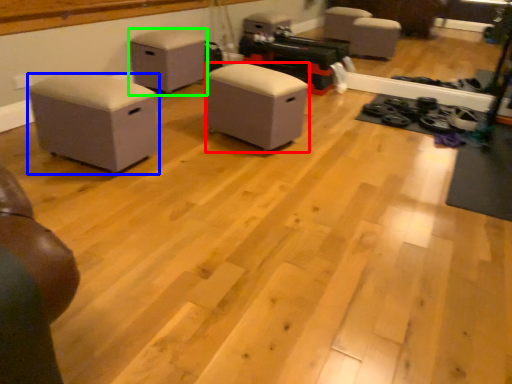
Question: Which object is positioned farthest from furniture (highlighted by a red box)? Select from furniture (highlighted by a blue box) and furniture (highlighted by a green box).

Choices:
 (A) furniture
 (B) furniture

Answer: (B)